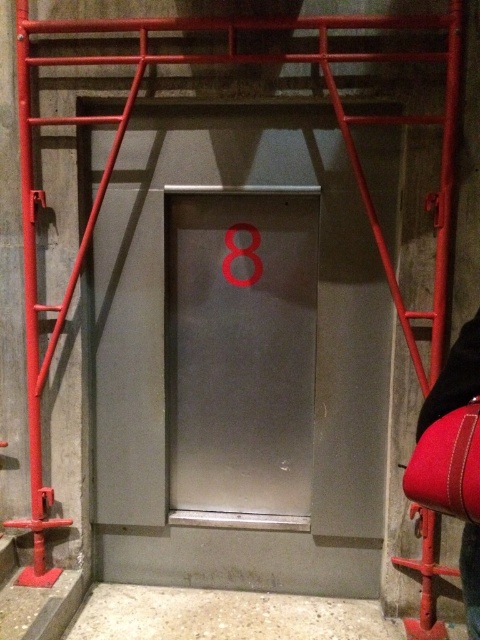
Question: Is marble floor at lower center further to the viewer compared to red leather stool at lower right?

Choices:
 (A) yes
 (B) no

Answer: (A)

Question: Estimate the real-world distances between objects in this image. Which object is farther from the metallic number at center?

Choices:
 (A) red leather pants at lower right
 (B) satin silver elevator door at center

Answer: (A)

Question: Is marble floor at lower center to the right of red leather stool at lower right from the viewer's perspective?

Choices:
 (A) yes
 (B) no

Answer: (B)

Question: Which of the following is the farthest from the observer?

Choices:
 (A) pos(455,355)
 (B) pos(262,376)
 (C) pos(127,634)
 (D) pos(253,278)

Answer: (B)

Question: Which object is the closest to the marble floor at lower center?

Choices:
 (A) red leather stool at lower right
 (B) satin silver elevator door at center
 (C) red leather pants at lower right
 (D) metallic number at center

Answer: (A)

Question: Is the position of red leather stool at lower right more distant than that of metallic number at center?

Choices:
 (A) no
 (B) yes

Answer: (A)